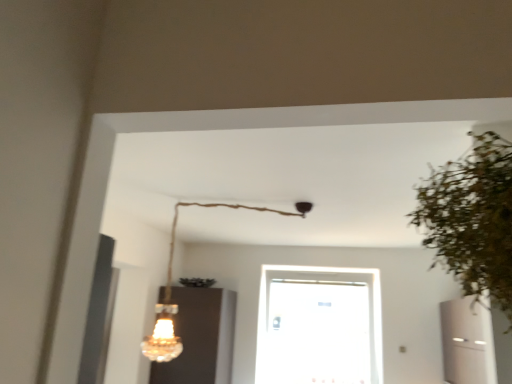
Measure the distance between crystal glass chandelier at upper center and camera.

They are 3.61 meters apart.

Identify the location of matte glass cabinet at lower left. (200, 338).

The height and width of the screenshot is (384, 512). Describe the element at coordinates (319, 326) in the screenshot. I see `transparent glass door at center` at that location.

In the scene shown: What is the approximate width of green leafy plant at right?

green leafy plant at right is 13.44 inches in width.

The width and height of the screenshot is (512, 384). Describe the element at coordinates (472, 219) in the screenshot. I see `green leafy plant at right` at that location.

Locate an element on the screen. This screenshot has width=512, height=384. crystal glass chandelier at upper center is located at coordinates [x=170, y=290].

Considering the relative sizes of transparent glass door at center and green leafy plant at right in the image provided, is transparent glass door at center bigger than green leafy plant at right?

Yes, transparent glass door at center is bigger than green leafy plant at right.

Considering the sizes of objects transparent glass door at center and green leafy plant at right in the image provided, who is wider, transparent glass door at center or green leafy plant at right?

Wider between the two is green leafy plant at right.

Is green leafy plant at right surrounded by transparent glass door at center?

No, transparent glass door at center does not contain green leafy plant at right.

From a real-world perspective, does transparent glass door at center sit lower than green leafy plant at right?

Indeed, from a real-world perspective, transparent glass door at center is positioned beneath green leafy plant at right.

In the scene shown: Considering the positions of objects green leafy plant at right and matte glass cabinet at lower left in the image provided, who is more to the right, green leafy plant at right or matte glass cabinet at lower left?

From the viewer's perspective, green leafy plant at right appears more on the right side.

Locate an element on the screen. The height and width of the screenshot is (384, 512). houseplant above the matte glass cabinet at lower left (from the image's perspective) is located at coordinates (472, 219).

Which is closer to the camera, [492,197] or [183,344]?

Clearly, point [492,197] is closer to the camera than point [183,344].

How different are the orientations of green leafy plant at right and matte glass cabinet at lower left in degrees?

The angular difference between green leafy plant at right and matte glass cabinet at lower left is 88.5 degrees.

From the image's perspective, is transparent glass door at center over white glossy air conditioner at right?

Incorrect, from the image's perspective, transparent glass door at center is lower than white glossy air conditioner at right.

Considering the sizes of objects transparent glass door at center and white glossy air conditioner at right in the image provided, who is shorter, transparent glass door at center or white glossy air conditioner at right?

Standing shorter between the two is white glossy air conditioner at right.

How different are the orientations of transparent glass door at center and white glossy air conditioner at right in degrees?

The angular difference between transparent glass door at center and white glossy air conditioner at right is 90.3 degrees.

Is transparent glass door at center bigger than white glossy air conditioner at right?

No.

Is white glossy air conditioner at right far away from transparent glass door at center?

Yes, white glossy air conditioner at right and transparent glass door at center are quite far apart.

Does white glossy air conditioner at right have a greater height compared to transparent glass door at center?

No.

Is white glossy air conditioner at right wider than transparent glass door at center?

Indeed, white glossy air conditioner at right has a greater width compared to transparent glass door at center.

Who is taller, green leafy plant at right or transparent glass door at center?

transparent glass door at center is taller.

What's the angular difference between green leafy plant at right and transparent glass door at center's facing directions?

90 degrees.

From the image's perspective, is green leafy plant at right below transparent glass door at center?

Actually, green leafy plant at right appears above transparent glass door at center in the image.

From the image's perspective, which one is positioned higher, matte glass cabinet at lower left or white glossy air conditioner at right?

white glossy air conditioner at right.

Is matte glass cabinet at lower left looking in the opposite direction of white glossy air conditioner at right?

No, matte glass cabinet at lower left is not facing away from white glossy air conditioner at right.

From the picture: From a real-world perspective, is matte glass cabinet at lower left positioned above or below white glossy air conditioner at right?

matte glass cabinet at lower left is situated lower than white glossy air conditioner at right in the real world.

Does matte glass cabinet at lower left have a smaller size compared to crystal glass chandelier at upper center?

Actually, matte glass cabinet at lower left might be larger than crystal glass chandelier at upper center.

In the scene shown: Is matte glass cabinet at lower left shorter than crystal glass chandelier at upper center?

Indeed, matte glass cabinet at lower left has a lesser height compared to crystal glass chandelier at upper center.

Is point (222, 328) behind point (162, 335)?

Yes, point (222, 328) is behind point (162, 335).

Is matte glass cabinet at lower left inside the boundaries of crystal glass chandelier at upper center, or outside?

matte glass cabinet at lower left is not inside crystal glass chandelier at upper center, it's outside.

Locate an element on the screen. The width and height of the screenshot is (512, 384). window behind the green leafy plant at right is located at coordinates (319, 326).

The width and height of the screenshot is (512, 384). Identify the location of houseplant that is above the matte glass cabinet at lower left (from a real-world perspective). (472, 219).

Estimate the real-world distances between objects in this image. Which object is further from green leafy plant at right, white glossy air conditioner at right or transparent glass door at center?

transparent glass door at center is positioned further to the anchor green leafy plant at right.

When comparing their distances from transparent glass door at center, does white glossy air conditioner at right or matte glass cabinet at lower left seem further?

white glossy air conditioner at right lies further to transparent glass door at center than the other object.

Estimate the real-world distances between objects in this image. Which object is closer to crystal glass chandelier at upper center, white glossy air conditioner at right or transparent glass door at center?

transparent glass door at center lies closer to crystal glass chandelier at upper center than the other object.

When comparing their distances from green leafy plant at right, does transparent glass door at center or matte glass cabinet at lower left seem further?

Based on the image, transparent glass door at center appears to be further to green leafy plant at right.

Looking at the image, which one is located further to matte glass cabinet at lower left, crystal glass chandelier at upper center or transparent glass door at center?

transparent glass door at center lies further to matte glass cabinet at lower left than the other object.

Looking at the image, which one is located closer to white glossy air conditioner at right, crystal glass chandelier at upper center or matte glass cabinet at lower left?

Based on the image, matte glass cabinet at lower left appears to be nearer to white glossy air conditioner at right.

When comparing their distances from matte glass cabinet at lower left, does green leafy plant at right or crystal glass chandelier at upper center seem closer?

Based on the image, crystal glass chandelier at upper center appears to be nearer to matte glass cabinet at lower left.

When comparing their distances from crystal glass chandelier at upper center, does transparent glass door at center or white glossy air conditioner at right seem further?

white glossy air conditioner at right lies further to crystal glass chandelier at upper center than the other object.

At what (x,y) coordinates should I click in order to perform the action: click on screen door located between green leafy plant at right and transparent glass door at center in the depth direction. Please return your answer as a coordinate pair (x, y). The width and height of the screenshot is (512, 384). Looking at the image, I should click on (467, 342).

Identify the location of screen door between green leafy plant at right and matte glass cabinet at lower left along the z-axis. (467, 342).

You are a GUI agent. You are given a task and a screenshot of the screen. Output one action in this format:
    pyautogui.click(x=<x>, y=<y>)
    Task: Click on the window between crystal glass chandelier at upper center and white glossy air conditioner at right in the horizontal direction
    Image resolution: width=512 pixels, height=384 pixels.
    Given the screenshot: What is the action you would take?
    pyautogui.click(x=319, y=326)

You are a GUI agent. You are given a task and a screenshot of the screen. Output one action in this format:
    pyautogui.click(x=<x>, y=<y>)
    Task: Click on the lamp between green leafy plant at right and matte glass cabinet at lower left in the front-back direction
    Image resolution: width=512 pixels, height=384 pixels.
    Given the screenshot: What is the action you would take?
    pyautogui.click(x=170, y=290)